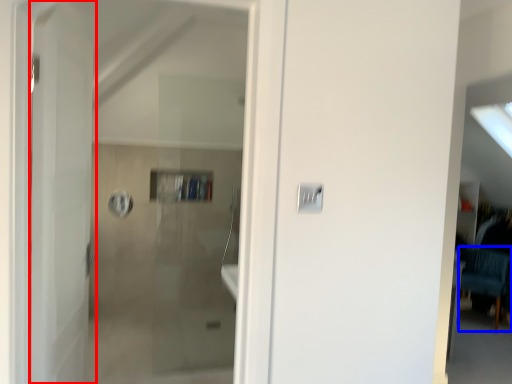
Question: Which point is further to the camera, door (highlighted by a red box) or furniture (highlighted by a blue box)?

Choices:
 (A) door
 (B) furniture

Answer: (B)